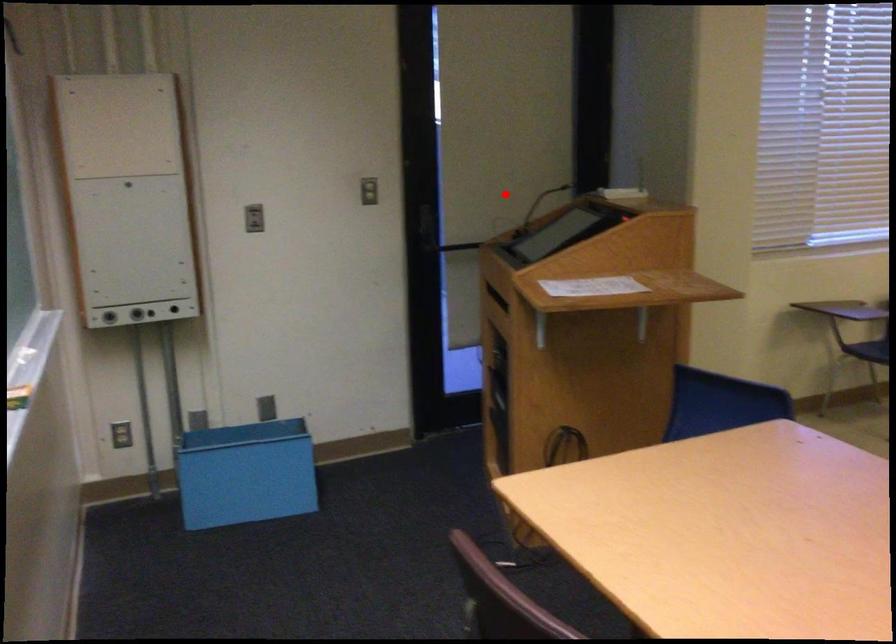
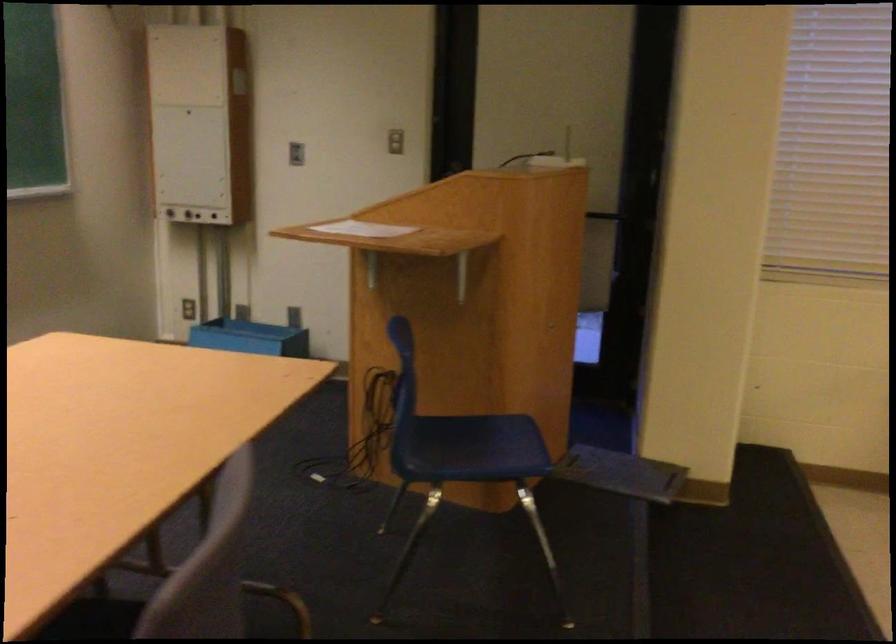
Where in the second image is the point corresponding to the highlighted location from the first image?

(556, 160)